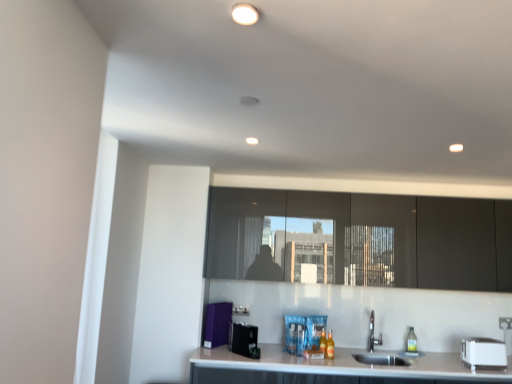
In order to face matte black cabinets at center, should I rotate leftwards or rightwards?

It's best to rotate right around 14.897 degrees.

Describe the element at coordinates (217, 324) in the screenshot. I see `purple fabric at lower center, which is the 1th appliance in left-to-right order` at that location.

Image resolution: width=512 pixels, height=384 pixels. What do you see at coordinates (323, 342) in the screenshot? I see `translucent plastic bottle at lower center, the first bottle positioned from the back` at bounding box center [323, 342].

Measure the distance between point (413,335) and camera.

Point (413,335) and camera are 3.41 meters apart from each other.

Describe the element at coordinates (483, 352) in the screenshot. I see `white plastic toaster at lower right, the 1th appliance when ordered from right to left` at that location.

What do you see at coordinates (244, 340) in the screenshot? Image resolution: width=512 pixels, height=384 pixels. I see `black plastic coffee machine at center, which is counted as the 2th appliance, starting from the left` at bounding box center [244, 340].

The image size is (512, 384). What do you see at coordinates (245, 14) in the screenshot? I see `white glossy light fixture at upper center` at bounding box center [245, 14].

Locate an element on the screen. matte black cabinets at center is located at coordinates (361, 239).

From the image's perspective, is translucent glass bottle at lower center, placed as the 1th bottle when sorted from front to back, positioned above or below translucent plastic bottle at sink right?

Clearly, from the image's perspective, translucent glass bottle at lower center, placed as the 1th bottle when sorted from front to back, is above translucent plastic bottle at sink right.

At what (x,y) coordinates should I click in order to perform the action: click on beverage that appears above the translucent glass bottle at lower center, the second bottle viewed from the back (from a real-world perspective). Please return your answer as a coordinate pair (x, y). Image resolution: width=512 pixels, height=384 pixels. Looking at the image, I should click on (411, 342).

Considering the relative positions of translucent glass bottle at lower center, placed as the 1th bottle when sorted from front to back, and translucent plastic bottle at sink right in the image provided, is translucent glass bottle at lower center, placed as the 1th bottle when sorted from front to back, to the left of translucent plastic bottle at sink right from the viewer's perspective?

Correct, you'll find translucent glass bottle at lower center, placed as the 1th bottle when sorted from front to back, to the left of translucent plastic bottle at sink right.

How much distance is there between translucent glass bottle at lower center, the second bottle viewed from the back, and translucent plastic bottle at sink right?

translucent glass bottle at lower center, the second bottle viewed from the back, and translucent plastic bottle at sink right are 26.44 inches apart.

Consider the image. Is translucent glass bottle at lower center, the second bottle viewed from the back, in front of purple fabric at lower center, which is the 1th appliance in left-to-right order?

Yes.

Between point (326, 346) and point (221, 317), which one is positioned behind?

The point (221, 317) is farther from the camera.

Is translucent glass bottle at lower center, the second bottle viewed from the back, with purple fabric at lower center, which is the 1th appliance in left-to-right order?

No, translucent glass bottle at lower center, the second bottle viewed from the back, is not with purple fabric at lower center, which is the 1th appliance in left-to-right order.

Could you tell me if translucent glass bottle at lower center, placed as the 1th bottle when sorted from front to back, is turned towards purple fabric at lower center, which is the 1th appliance in left-to-right order?

No, translucent glass bottle at lower center, placed as the 1th bottle when sorted from front to back, is not turned towards purple fabric at lower center, which is the 1th appliance in left-to-right order.

At what (x,y) coordinates should I click in order to perform the action: click on beverage on the right of purple fabric at lower center, which is the 1th appliance in left-to-right order. Please return your answer as a coordinate pair (x, y). Looking at the image, I should click on (411, 342).

Can you confirm if translucent plastic bottle at sink right is wider than purple fabric at lower center, which is the 1th appliance in left-to-right order?

Incorrect, the width of translucent plastic bottle at sink right does not surpass that of purple fabric at lower center, which is the 1th appliance in left-to-right order.

Can you confirm if translucent plastic bottle at sink right is positioned to the left of purple fabric at lower center, marked as the third appliance in a right-to-left arrangement?

No.

From the image's perspective, relative to translucent plastic bottle at lower center, the second bottle positioned from the front, is matte black cabinets at center above or below?

Clearly, from the image's perspective, matte black cabinets at center is above translucent plastic bottle at lower center, the second bottle positioned from the front.

Would you say matte black cabinets at center is to the left or to the right of translucent plastic bottle at lower center, the first bottle positioned from the back, in the picture?

Based on their positions, matte black cabinets at center is located to the right of translucent plastic bottle at lower center, the first bottle positioned from the back.

Is matte black cabinets at center inside or outside of translucent plastic bottle at lower center, the first bottle positioned from the back?

matte black cabinets at center is located beyond the bounds of translucent plastic bottle at lower center, the first bottle positioned from the back.

Which is in front, point (508, 228) or point (322, 351)?

The point (322, 351) is closer to the camera.

Which is in front, purple fabric at lower center, which is the 1th appliance in left-to-right order, or translucent plastic bottle at sink right?

purple fabric at lower center, which is the 1th appliance in left-to-right order.

Which is closer to the camera, [223,306] or [409,335]?

The point [223,306] is in front.

Considering the sizes of objects purple fabric at lower center, marked as the third appliance in a right-to-left arrangement, and translucent plastic bottle at sink right in the image provided, who is taller, purple fabric at lower center, marked as the third appliance in a right-to-left arrangement, or translucent plastic bottle at sink right?

Standing taller between the two is purple fabric at lower center, marked as the third appliance in a right-to-left arrangement.

Is purple fabric at lower center, marked as the third appliance in a right-to-left arrangement, smaller than translucent plastic bottle at sink right?

No.

Based on their positions, is matte black cabinets at center located to the left or right of black plastic coffee machine at center, positioned as the 2th appliance in right-to-left order?

Clearly, matte black cabinets at center is on the right of black plastic coffee machine at center, positioned as the 2th appliance in right-to-left order, in the image.

Can you confirm if matte black cabinets at center is wider than black plastic coffee machine at center, which is counted as the 2th appliance, starting from the left?

Incorrect, the width of matte black cabinets at center does not surpass that of black plastic coffee machine at center, which is counted as the 2th appliance, starting from the left.

Between point (397, 201) and point (250, 348), which one is positioned in front?

Point (250, 348)

Which of these two, matte black cabinets at center or black plastic coffee machine at center, positioned as the 2th appliance in right-to-left order, is bigger?

matte black cabinets at center.

From a real-world perspective, relative to translucent glass bottle at lower center, the second bottle viewed from the back, is black plastic coffee machine at center, positioned as the 2th appliance in right-to-left order, vertically above or below?

black plastic coffee machine at center, positioned as the 2th appliance in right-to-left order, is above translucent glass bottle at lower center, the second bottle viewed from the back.

Would you say black plastic coffee machine at center, positioned as the 2th appliance in right-to-left order, is a long distance from translucent glass bottle at lower center, the second bottle viewed from the back?

Actually, black plastic coffee machine at center, positioned as the 2th appliance in right-to-left order, and translucent glass bottle at lower center, the second bottle viewed from the back, are a little close together.

In the scene shown: In terms of width, does black plastic coffee machine at center, positioned as the 2th appliance in right-to-left order, look wider or thinner when compared to translucent glass bottle at lower center, the second bottle viewed from the back?

In the image, black plastic coffee machine at center, positioned as the 2th appliance in right-to-left order, appears to be wider than translucent glass bottle at lower center, the second bottle viewed from the back.

Where is `beverage that appears below the translucent glass bottle at lower center, the second bottle viewed from the back (from the image's perspective)`? The height and width of the screenshot is (384, 512). beverage that appears below the translucent glass bottle at lower center, the second bottle viewed from the back (from the image's perspective) is located at coordinates (411, 342).

From a real-world perspective, count 2nd appliances upward from the translucent glass bottle at lower center, placed as the 1th bottle when sorted from front to back, and point to it. Please provide its 2D coordinates.

[(217, 324)]

When comparing their distances from black plastic coffee machine at center, positioned as the 2th appliance in right-to-left order, does translucent plastic bottle at sink right or translucent plastic bottle at lower center, the first bottle positioned from the back, seem further?

translucent plastic bottle at sink right is positioned further to the anchor black plastic coffee machine at center, positioned as the 2th appliance in right-to-left order.

When comparing their distances from translucent plastic bottle at lower center, the first bottle positioned from the back, does purple fabric at lower center, marked as the third appliance in a right-to-left arrangement, or white glossy light fixture at upper center seem closer?

Based on the image, purple fabric at lower center, marked as the third appliance in a right-to-left arrangement, appears to be nearer to translucent plastic bottle at lower center, the first bottle positioned from the back.

Estimate the real-world distances between objects in this image. Which object is further from white glossy light fixture at upper center, translucent glass bottle at lower center, placed as the 1th bottle when sorted from front to back, or black plastic coffee machine at center, which is counted as the 2th appliance, starting from the left?

translucent glass bottle at lower center, placed as the 1th bottle when sorted from front to back, is further to white glossy light fixture at upper center.

Considering their positions, is white plastic toaster at lower right, arranged as the 3th appliance when viewed from the left, positioned further to black plastic coffee machine at center, which is counted as the 2th appliance, starting from the left, than purple fabric at lower center, marked as the third appliance in a right-to-left arrangement?

white plastic toaster at lower right, arranged as the 3th appliance when viewed from the left, is positioned further to the anchor black plastic coffee machine at center, which is counted as the 2th appliance, starting from the left.

When comparing their distances from translucent plastic bottle at lower center, the second bottle positioned from the front, does purple fabric at lower center, marked as the third appliance in a right-to-left arrangement, or translucent plastic bottle at sink right seem closer?

The object closer to translucent plastic bottle at lower center, the second bottle positioned from the front, is translucent plastic bottle at sink right.

From the image, which object appears to be farther from matte black cabinets at center, translucent plastic bottle at sink right or translucent plastic bottle at lower center, the second bottle positioned from the front?

Based on the image, translucent plastic bottle at sink right appears to be further to matte black cabinets at center.

Based on their spatial positions, is purple fabric at lower center, marked as the third appliance in a right-to-left arrangement, or black plastic coffee machine at center, positioned as the 2th appliance in right-to-left order, closer to white plastic toaster at lower right, the 1th appliance when ordered from right to left?

black plastic coffee machine at center, positioned as the 2th appliance in right-to-left order.

When comparing their distances from black plastic coffee machine at center, which is counted as the 2th appliance, starting from the left, does white glossy light fixture at upper center or purple fabric at lower center, marked as the third appliance in a right-to-left arrangement, seem further?

Based on the image, white glossy light fixture at upper center appears to be further to black plastic coffee machine at center, which is counted as the 2th appliance, starting from the left.

In order to click on bottle between matte black cabinets at center and translucent plastic bottle at lower center, the second bottle positioned from the front, in the up-down direction in this screenshot , I will do (x=329, y=346).

Image resolution: width=512 pixels, height=384 pixels. Identify the location of appliance positioned between white glossy light fixture at upper center and white plastic toaster at lower right, the 1th appliance when ordered from right to left, from near to far. 244,340.

Locate an element on the screen. This screenshot has width=512, height=384. cabinetry positioned between white glossy light fixture at upper center and purple fabric at lower center, which is the 1th appliance in left-to-right order, from near to far is located at coordinates (361, 239).

Where is `appliance situated between purple fabric at lower center, marked as the third appliance in a right-to-left arrangement, and translucent plastic bottle at sink right from left to right`? This screenshot has height=384, width=512. appliance situated between purple fabric at lower center, marked as the third appliance in a right-to-left arrangement, and translucent plastic bottle at sink right from left to right is located at coordinates (244, 340).